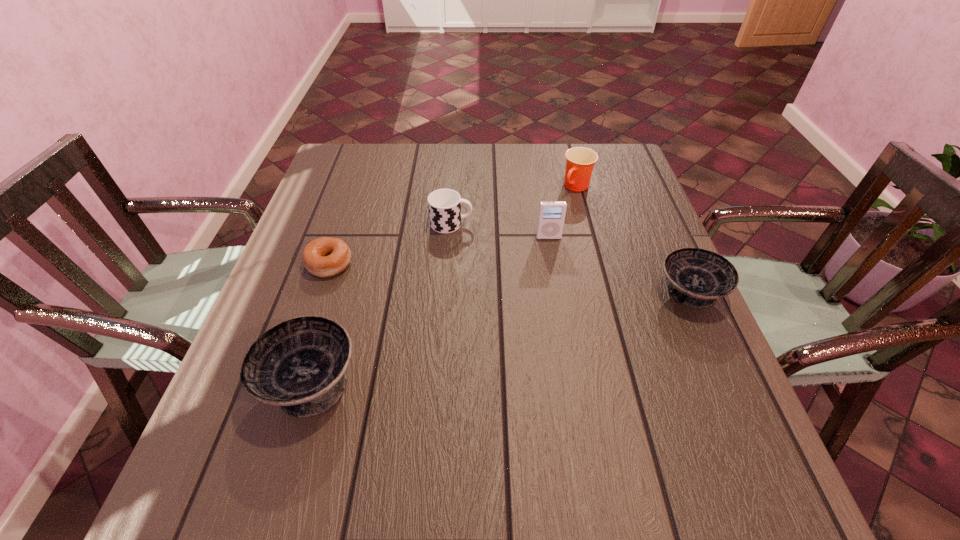
The image size is (960, 540). I want to click on the taller bowl, so click(299, 364).

Locate an element on the screen. the left bowl is located at coordinates (299, 364).

This screenshot has height=540, width=960. Identify the location of the rightmost object. (697, 277).

You are a GUI agent. You are given a task and a screenshot of the screen. Output one action in this format:
    pyautogui.click(x=<x>, y=<y>)
    Task: Click on the right bowl
    The width and height of the screenshot is (960, 540).
    Given the screenshot: What is the action you would take?
    pyautogui.click(x=697, y=277)

Locate an element on the screen. The width and height of the screenshot is (960, 540). the shortest object is located at coordinates [x=323, y=257].

Where is `the shorter cup`? The width and height of the screenshot is (960, 540). the shorter cup is located at coordinates (444, 205).

The width and height of the screenshot is (960, 540). Identify the location of the fourth object from right to left. (444, 205).

Where is `the right cup`? the right cup is located at coordinates (580, 161).

Locate an element on the screen. the farthest object is located at coordinates (580, 161).

The height and width of the screenshot is (540, 960). In order to click on the third farthest object in this screenshot , I will do `click(551, 216)`.